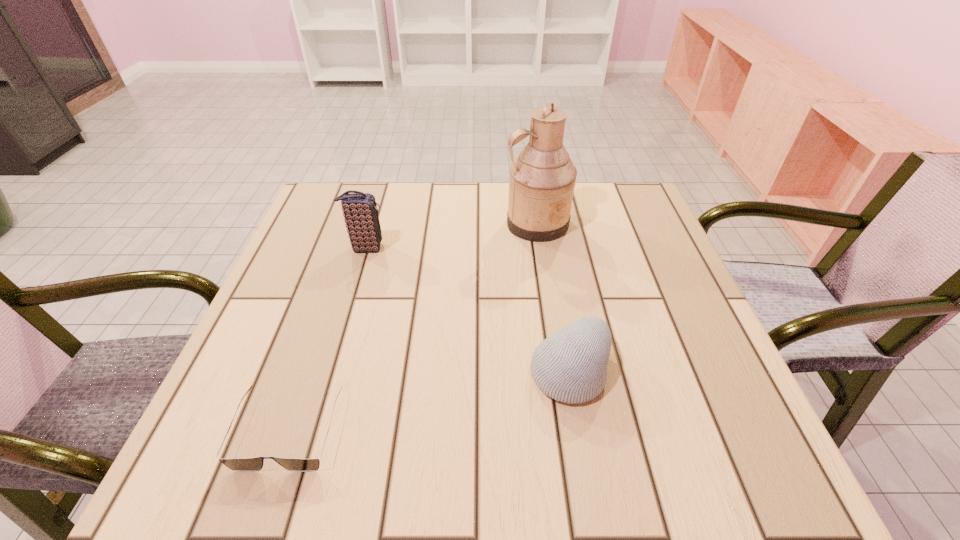
Where is `sunglasses at the left edge`? sunglasses at the left edge is located at coordinates (243, 464).

At what (x,y) coordinates should I click in order to perform the action: click on object positioned at the near left corner. Please return your answer as a coordinate pair (x, y). The height and width of the screenshot is (540, 960). Looking at the image, I should click on (243, 464).

The image size is (960, 540). Find the location of `vacant space at the far edge of the desktop`. vacant space at the far edge of the desktop is located at coordinates (431, 200).

You are a GUI agent. You are given a task and a screenshot of the screen. Output one action in this format:
    pyautogui.click(x=<x>, y=<y>)
    Task: Click on the blank area at the near edge
    The height and width of the screenshot is (540, 960).
    Given the screenshot: What is the action you would take?
    pyautogui.click(x=616, y=437)

In the image, there is a desktop. Where is `free space at the left edge`? The image size is (960, 540). free space at the left edge is located at coordinates (228, 392).

Find the location of a particular element. vacant point at the right edge is located at coordinates (678, 373).

Where is `vacant space at the far left corner of the desktop`? The image size is (960, 540). vacant space at the far left corner of the desktop is located at coordinates (363, 192).

Locate an element on the screen. This screenshot has width=960, height=540. free location at the far right corner is located at coordinates (594, 202).

Identify the location of unoccupied position between the shortest object and the second shortest object. (430, 401).

In order to click on vacant space in between the pitcher and the second tallest object in this screenshot , I will do `click(451, 235)`.